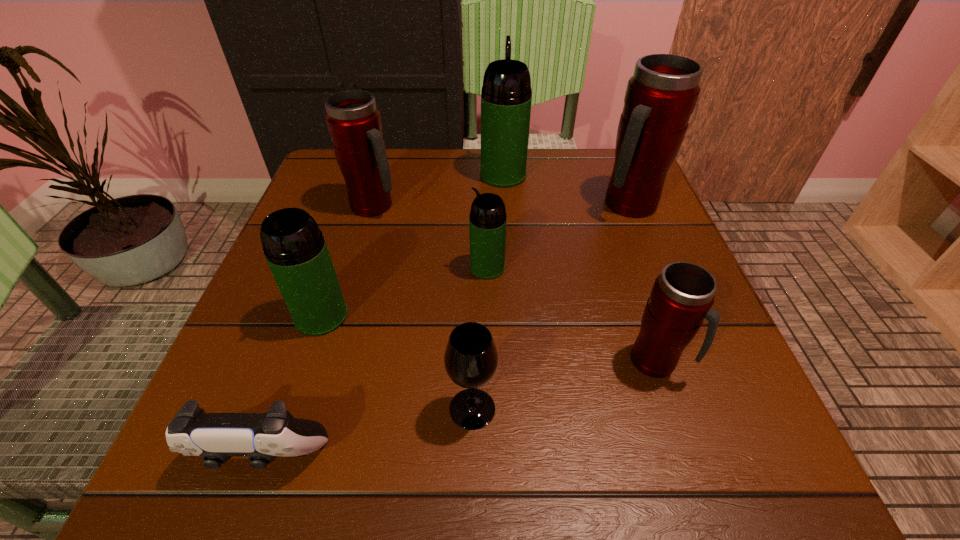
Where is `wineglass located in the near edge section of the desktop`? Image resolution: width=960 pixels, height=540 pixels. wineglass located in the near edge section of the desktop is located at coordinates tap(471, 359).

Find the location of a particular element. control at the near edge is located at coordinates (216, 437).

In order to click on control that is at the left edge in this screenshot , I will do `click(216, 437)`.

You are a GUI agent. You are given a task and a screenshot of the screen. Output one action in this format:
    pyautogui.click(x=<x>, y=<y>)
    Task: Click on the object situated at the far left corner
    This screenshot has width=960, height=540.
    Given the screenshot: What is the action you would take?
    pyautogui.click(x=354, y=122)

Locate an element on the screen. The width and height of the screenshot is (960, 540). object at the near left corner is located at coordinates (216, 437).

Where is `object that is at the far right corner`? object that is at the far right corner is located at coordinates (660, 97).

This screenshot has height=540, width=960. In the image, there is a desktop. In order to click on vacant space at the far edge in this screenshot , I will do `click(540, 178)`.

You are a GUI agent. You are given a task and a screenshot of the screen. Output one action in this format:
    pyautogui.click(x=<x>, y=<y>)
    Task: Click on the vacant area at the left edge of the desktop
    This screenshot has height=540, width=960.
    Given the screenshot: What is the action you would take?
    pyautogui.click(x=359, y=228)

Where is `vacant space at the right edge of the desktop`? The image size is (960, 540). vacant space at the right edge of the desktop is located at coordinates (619, 225).

Image resolution: width=960 pixels, height=540 pixels. In the image, there is a desktop. In order to click on blank space at the near left corner in this screenshot , I will do 238,490.